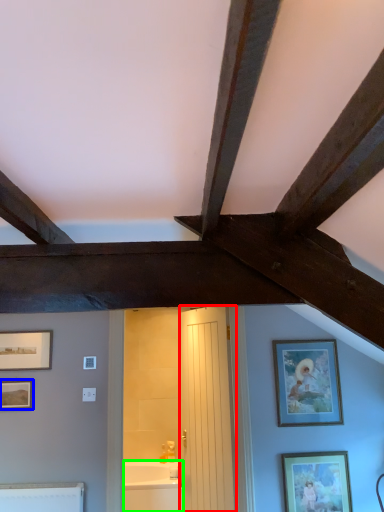
Question: Which object is positioned farthest from door (highlighted by a red box)? Select from picture frame (highlighted by a blue box) and bathtub (highlighted by a green box).

Choices:
 (A) picture frame
 (B) bathtub

Answer: (A)